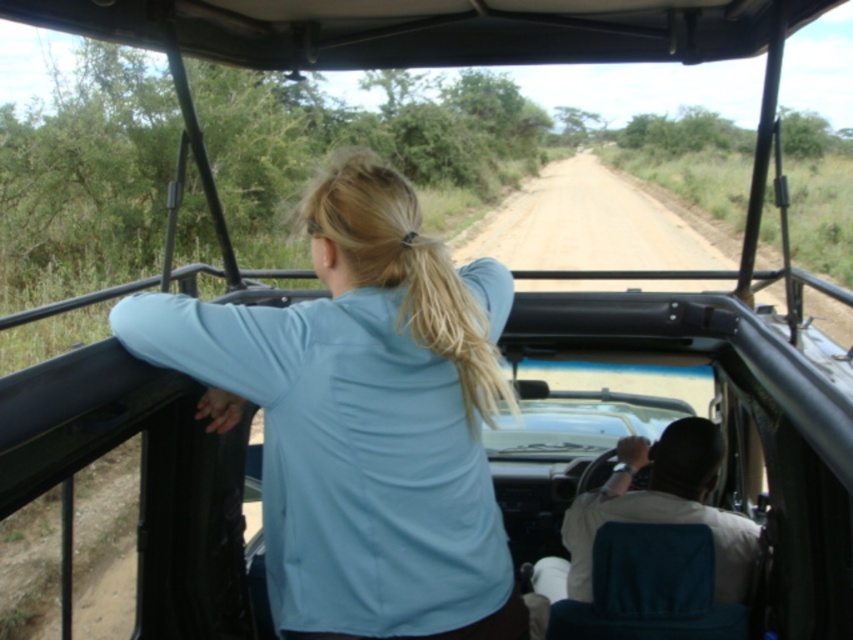
Question: Which point appears closest to the camera in this image?

Choices:
 (A) (704, 461)
 (B) (438, 467)

Answer: (B)

Question: Can you confirm if light blue fabric at center is smaller than white cotton shirt at center?

Choices:
 (A) yes
 (B) no

Answer: (A)

Question: Considering the relative positions of light blue fabric at center and white cotton shirt at center in the image provided, where is light blue fabric at center located with respect to white cotton shirt at center?

Choices:
 (A) left
 (B) right

Answer: (A)

Question: Which point is farther to the camera?

Choices:
 (A) (485, 340)
 (B) (693, 516)

Answer: (B)

Question: Is light blue fabric at center wider than white cotton shirt at center?

Choices:
 (A) no
 (B) yes

Answer: (B)

Question: Among these points, which one is farthest from the camera?

Choices:
 (A) (234, 314)
 (B) (648, 516)

Answer: (B)